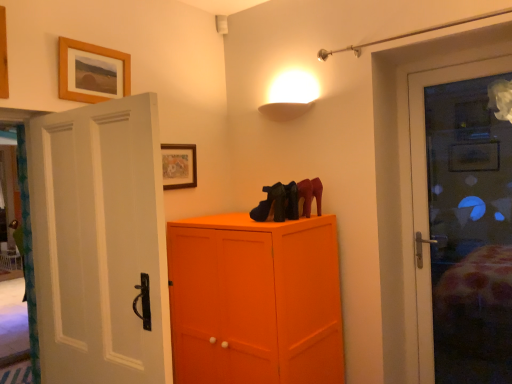
Question: Is the position of matte black shoes at center more distant than that of matte wooden picture frame at upper center, placed as the 1th picture frame when sorted from bottom to top?

Choices:
 (A) no
 (B) yes

Answer: (A)

Question: From the image's perspective, is matte black shoes at center located above matte wooden picture frame at upper center, marked as the 2th picture frame in a top-to-bottom arrangement?

Choices:
 (A) yes
 (B) no

Answer: (B)

Question: Is matte black shoes at center smaller than matte wooden picture frame at upper center, placed as the 1th picture frame when sorted from bottom to top?

Choices:
 (A) yes
 (B) no

Answer: (B)

Question: Does matte black shoes at center touch matte wooden picture frame at upper center, which is the first picture frame in back-to-front order?

Choices:
 (A) yes
 (B) no

Answer: (B)

Question: From a real-world perspective, is matte black shoes at center on top of matte wooden picture frame at upper center, which is the first picture frame in back-to-front order?

Choices:
 (A) no
 (B) yes

Answer: (A)

Question: From the image's perspective, is wooden picture frame at upper center, the 2th picture frame from the right, above or below matte wooden picture frame at upper center, placed as the 1th picture frame when sorted from bottom to top?

Choices:
 (A) above
 (B) below

Answer: (A)

Question: Is point (84, 91) closer or farther from the camera than point (164, 155)?

Choices:
 (A) closer
 (B) farther

Answer: (A)

Question: Choose the correct answer: Is wooden picture frame at upper center, placed as the second picture frame when sorted from bottom to top, inside matte wooden picture frame at upper center, placed as the 1th picture frame when sorted from bottom to top, or outside it?

Choices:
 (A) outside
 (B) inside

Answer: (A)

Question: Looking at the image, does wooden picture frame at upper center, which is counted as the first picture frame, starting from the front, seem bigger or smaller compared to matte wooden picture frame at upper center, acting as the 2th picture frame starting from the left?

Choices:
 (A) big
 (B) small

Answer: (A)

Question: Is matte black shoes at center bigger or smaller than matte wooden picture frame at upper center, which is the first picture frame in back-to-front order?

Choices:
 (A) big
 (B) small

Answer: (A)

Question: Considering the positions of matte black shoes at center and matte wooden picture frame at upper center, which is the first picture frame from right to left, in the image, is matte black shoes at center taller or shorter than matte wooden picture frame at upper center, which is the first picture frame from right to left,?

Choices:
 (A) tall
 (B) short

Answer: (B)

Question: Looking at their shapes, would you say matte black shoes at center is wider or thinner than matte wooden picture frame at upper center, placed as the 1th picture frame when sorted from bottom to top?

Choices:
 (A) wide
 (B) thin

Answer: (A)

Question: From a real-world perspective, is matte black shoes at center positioned above or below matte wooden picture frame at upper center, placed as the 2th picture frame when sorted from front to back?

Choices:
 (A) above
 (B) below

Answer: (B)

Question: Considering the positions of wooden picture frame at upper center, acting as the 1th picture frame starting from the left, and matte black shoes at center in the image, is wooden picture frame at upper center, acting as the 1th picture frame starting from the left, taller or shorter than matte black shoes at center?

Choices:
 (A) short
 (B) tall

Answer: (B)

Question: From the image's perspective, is wooden picture frame at upper center, marked as the first picture frame in a top-to-bottom arrangement, located above or below matte black shoes at center?

Choices:
 (A) below
 (B) above

Answer: (B)